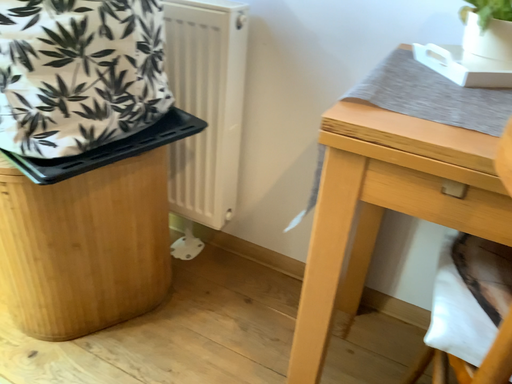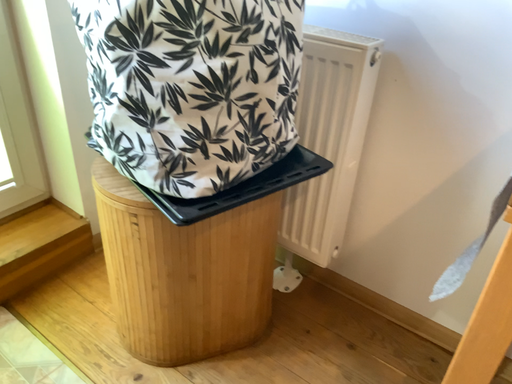
Question: How did the camera likely rotate when shooting the video?

Choices:
 (A) rotated right
 (B) rotated left

Answer: (B)